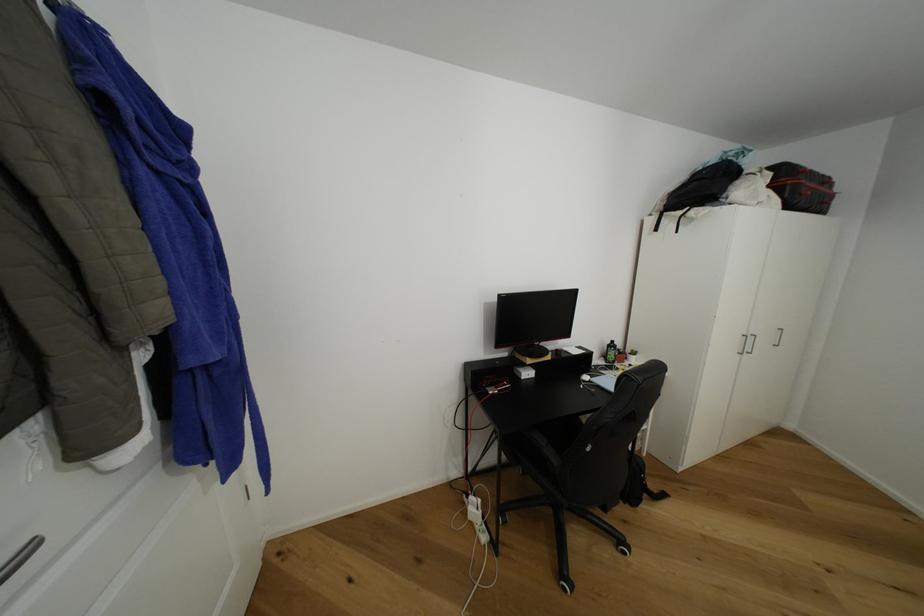
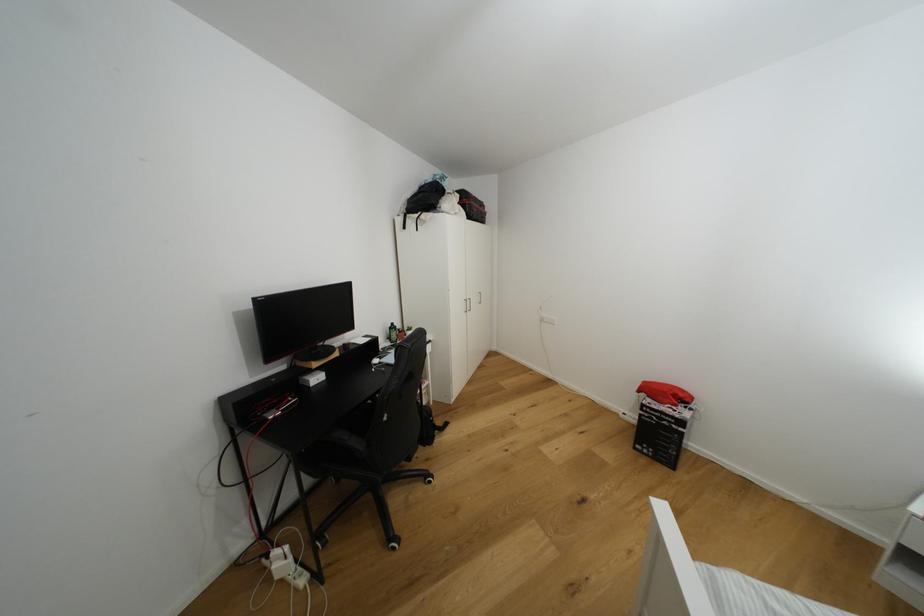
The point at [614,347] is marked in the first image. Where is the corresponding point in the second image?

(395, 330)